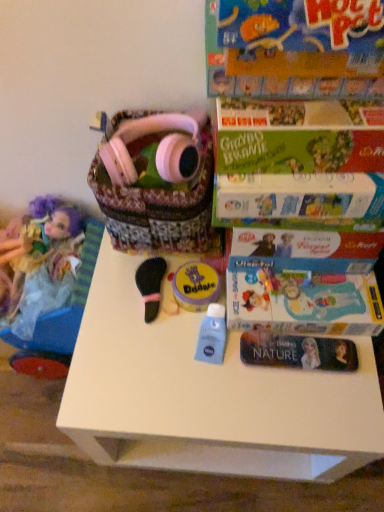
Question: Looking at the image, does pink matte headphones at upper center seem bigger or smaller compared to green cardboard book at upper right, acting as the 2th paperback book starting from the back?

Choices:
 (A) small
 (B) big

Answer: (A)

Question: From the image's perspective, is pink matte headphones at upper center positioned above or below green cardboard book at upper right, which appears as the 1th paperback book when viewed from the front?

Choices:
 (A) above
 (B) below

Answer: (A)

Question: Which object is positioned closest to the matte purple doll at left?

Choices:
 (A) black felt brush at center, which is the 1th toy in left-to-right order
 (B) blue matte lotion at center
 (C) green cardboard book at upper right, which appears as the 1th paperback book when viewed from the front
 (D) pink matte headphones at upper center
 (E) white plastic table at center

Answer: (A)

Question: Estimate the real-world distances between objects in this image. Which object is farther from the white plastic table at center?

Choices:
 (A) pink fabric basket at upper center
 (B) pink matte headphones at upper center
 (C) green cardboard book at upper right, which appears as the 1th paperback book when viewed from the front
 (D) matte cardboard book at upper right, the 1th paperback book in the back-to-front sequence
 (E) yellow matte doodle at center, the second toy when ordered from left to right

Answer: (B)